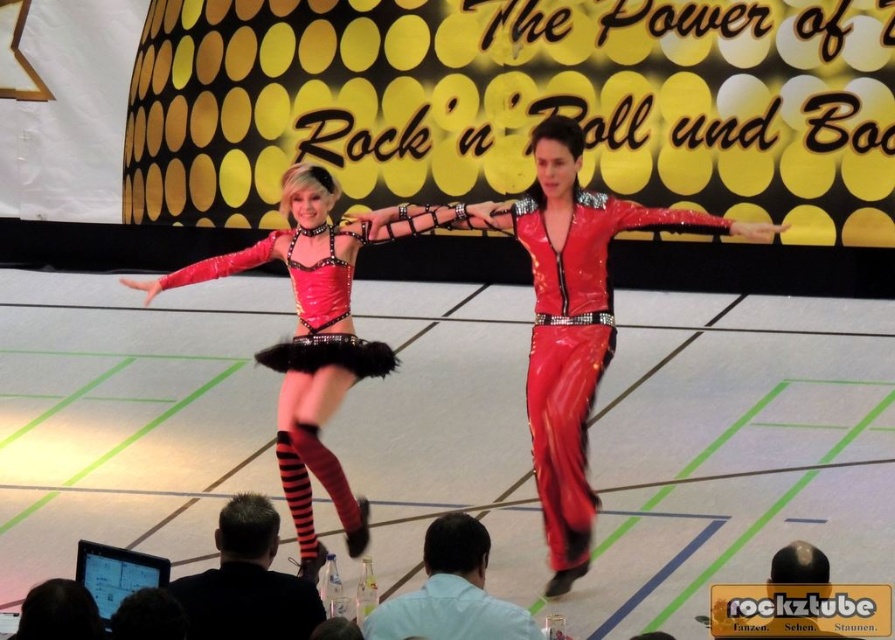
From the picture: Does shiny red jumpsuit at center have a greater height compared to light blue shirt at lower center?

Indeed, shiny red jumpsuit at center has a greater height compared to light blue shirt at lower center.

Who is positioned more to the right, shiny red jumpsuit at center or light blue shirt at lower center?

Positioned to the right is shiny red jumpsuit at center.

What do you see at coordinates (575, 348) in the screenshot? This screenshot has width=895, height=640. I see `shiny red jumpsuit at center` at bounding box center [575, 348].

At what (x,y) coordinates should I click in order to perform the action: click on shiny red jumpsuit at center. Please return your answer as a coordinate pair (x, y). Looking at the image, I should click on (575, 348).

Between point (347, 356) and point (263, 500), which one is positioned behind?

The point (347, 356) is behind.

Which is in front, point (246, 257) or point (234, 624)?

Point (234, 624) is more forward.

Find the location of a particular element. This screenshot has width=895, height=640. shiny red dress at center is located at coordinates (318, 336).

Between shiny red jumpsuit at center and black leather jacket at lower center, which one is positioned higher?

Positioned higher is shiny red jumpsuit at center.

What do you see at coordinates (575, 348) in the screenshot? The width and height of the screenshot is (895, 640). I see `shiny red jumpsuit at center` at bounding box center [575, 348].

Describe the element at coordinates (575, 348) in the screenshot. I see `shiny red jumpsuit at center` at that location.

Where is `shiny red jumpsuit at center`? This screenshot has width=895, height=640. shiny red jumpsuit at center is located at coordinates (575, 348).